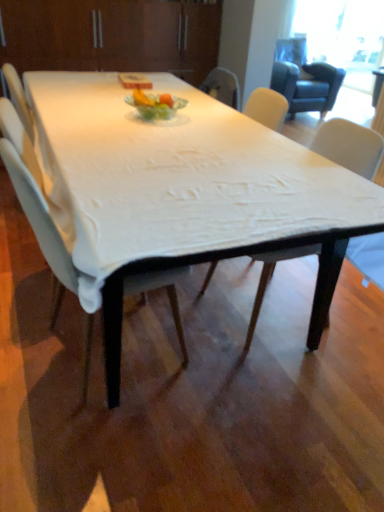
Question: Considering the relative sizes of white glass plate at center and white fabric chair at center, arranged as the 1th chair when viewed from the left, in the image provided, is white glass plate at center wider than white fabric chair at center, arranged as the 1th chair when viewed from the left,?

Choices:
 (A) yes
 (B) no

Answer: (B)

Question: Is white glass plate at center closer to camera compared to white fabric chair at center, acting as the second chair starting from the right?

Choices:
 (A) no
 (B) yes

Answer: (A)

Question: Is white glass plate at center smaller than white fabric chair at center, arranged as the 1th chair when viewed from the left?

Choices:
 (A) yes
 (B) no

Answer: (A)

Question: From the image's perspective, is white glass plate at center over white fabric chair at center, acting as the second chair starting from the right?

Choices:
 (A) no
 (B) yes

Answer: (B)

Question: From a real-world perspective, is white glass plate at center beneath white fabric chair at center, acting as the second chair starting from the right?

Choices:
 (A) yes
 (B) no

Answer: (B)

Question: Looking at the image, does transparent glass window screen at upper right seem bigger or smaller compared to white fabric chair at center, marked as the second chair in a left-to-right arrangement?

Choices:
 (A) small
 (B) big

Answer: (B)

Question: Is transparent glass window screen at upper right spatially inside white fabric chair at center, the first chair viewed from the right, or outside of it?

Choices:
 (A) inside
 (B) outside

Answer: (B)

Question: From a real-world perspective, is transparent glass window screen at upper right above or below white fabric chair at center, marked as the second chair in a left-to-right arrangement?

Choices:
 (A) below
 (B) above

Answer: (B)

Question: Relative to white fabric chair at center, the first chair viewed from the right, is transparent glass window screen at upper right in front or behind?

Choices:
 (A) front
 (B) behind

Answer: (B)

Question: Which is correct: white fabric-covered table at center is inside white glass plate at center, or outside of it?

Choices:
 (A) outside
 (B) inside

Answer: (A)

Question: From the image's perspective, relative to white glass plate at center, is white fabric-covered table at center above or below?

Choices:
 (A) above
 (B) below

Answer: (B)

Question: From a real-world perspective, is white fabric-covered table at center above or below white glass plate at center?

Choices:
 (A) above
 (B) below

Answer: (B)

Question: Considering the relative positions of white fabric-covered table at center and white glass plate at center in the image provided, is white fabric-covered table at center to the left or to the right of white glass plate at center?

Choices:
 (A) left
 (B) right

Answer: (A)

Question: From a real-world perspective, is white glass plate at center positioned above or below white fabric chair at center, marked as the second chair in a left-to-right arrangement?

Choices:
 (A) above
 (B) below

Answer: (A)

Question: Based on their positions, is white glass plate at center located to the left or right of white fabric chair at center, marked as the second chair in a left-to-right arrangement?

Choices:
 (A) left
 (B) right

Answer: (A)